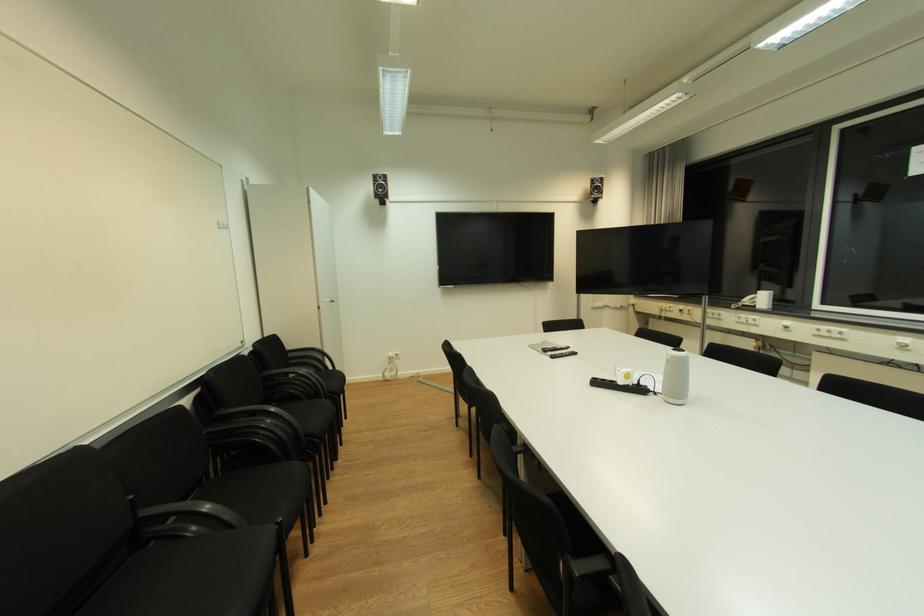
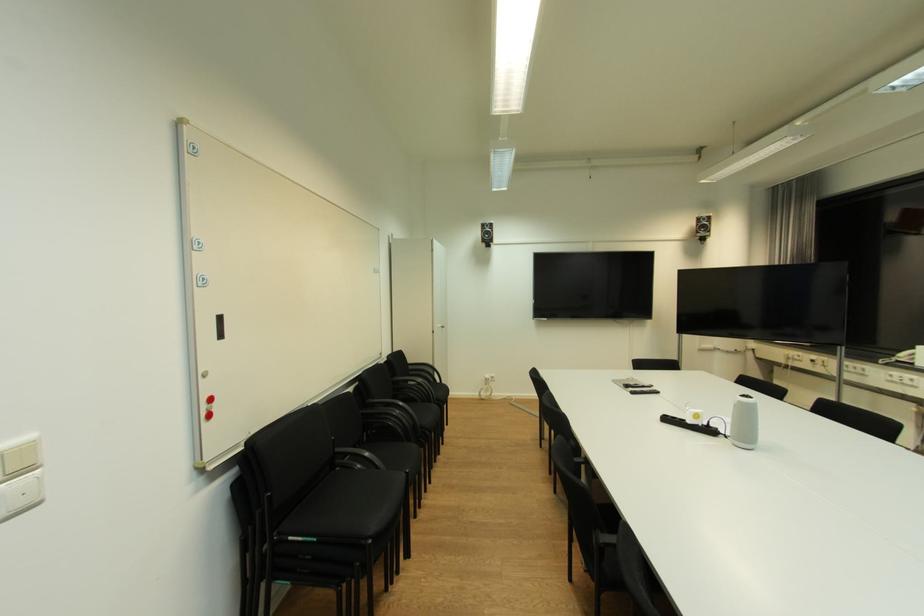
In the second image, find the point that corresponds to (x=137, y=498) in the first image.

(338, 439)